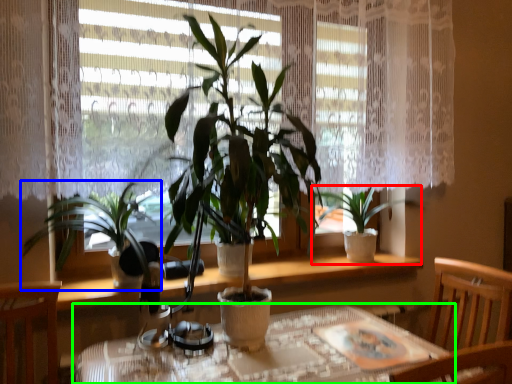
Question: Which object is the closest to the houseplant (highlighted by a red box)? Choose among these: houseplant (highlighted by a blue box) or table (highlighted by a green box).

Choices:
 (A) houseplant
 (B) table

Answer: (B)